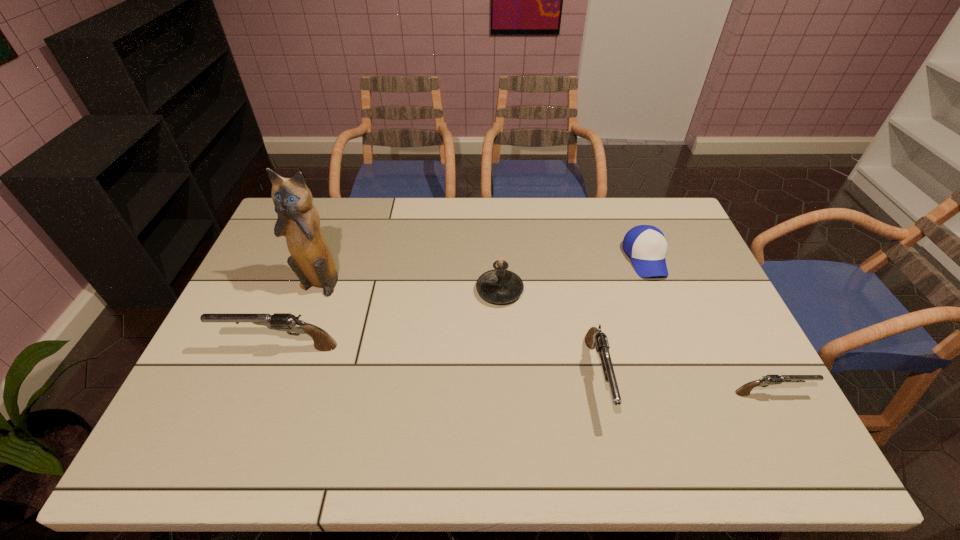
Please point a location where one more gun can be added evenly. Please provide its 2D coordinates. Your answer should be formatted as a tuple, i.e. [(x, y)], where the tuple contains the x and y coordinates of a point satisfying the conditions above.

[(434, 361)]